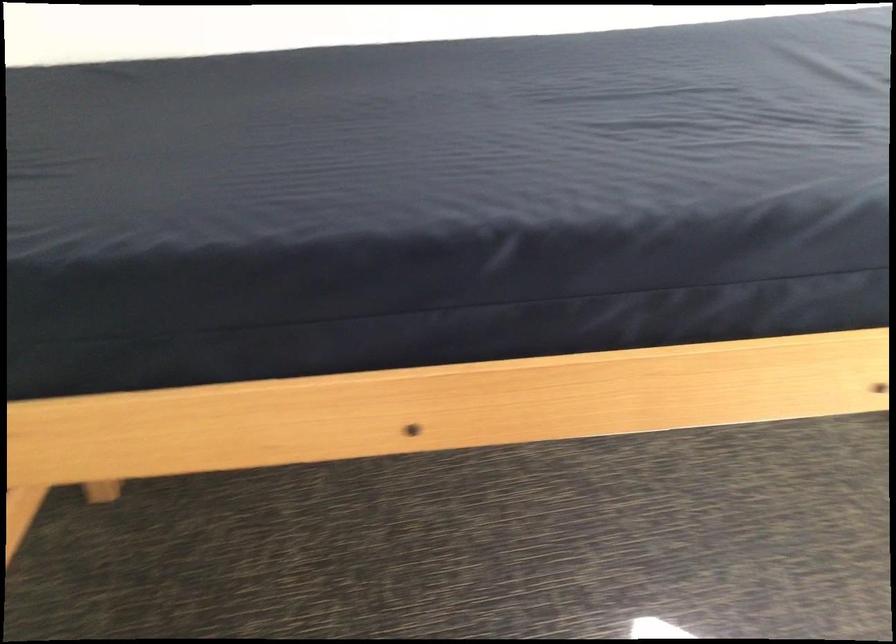
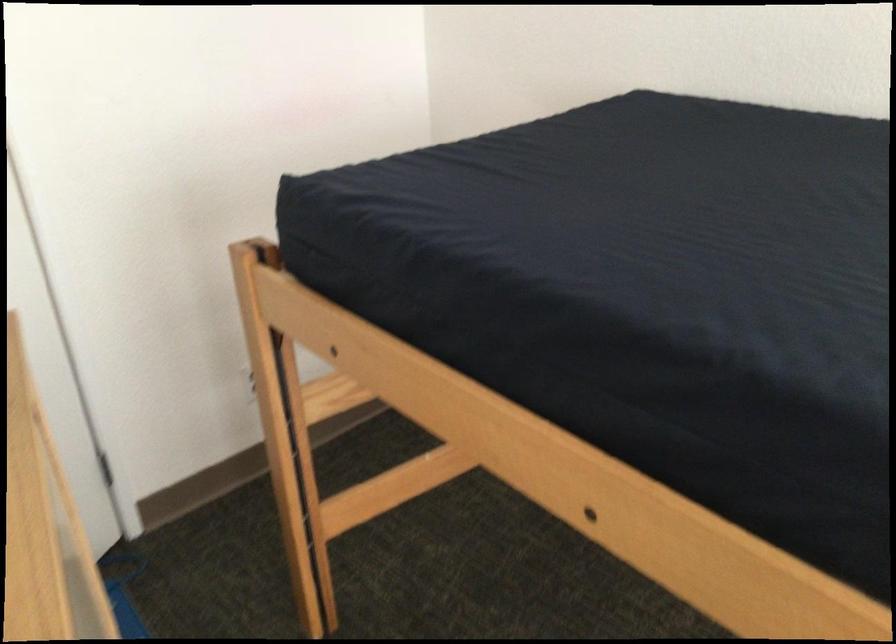
Find the pixel in the second image that matches [250,180] in the first image.

(636, 228)